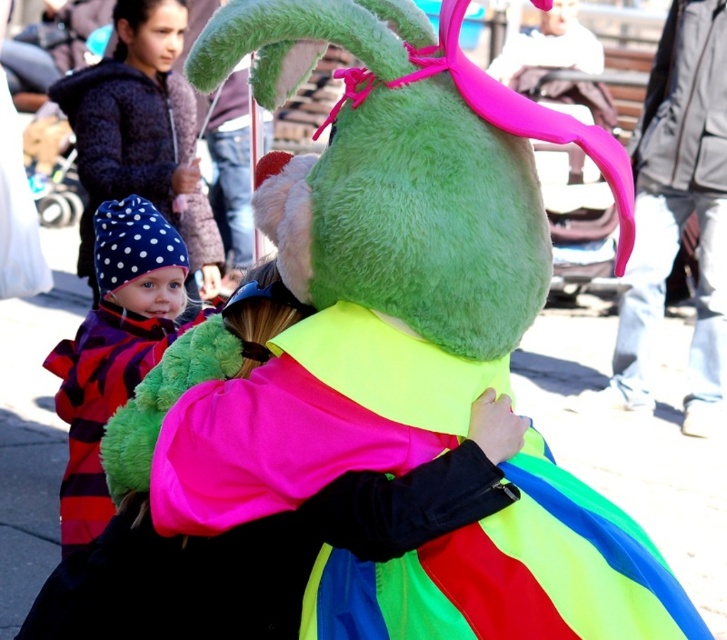
You are a photographer at the event and want to capture a photo where the polka dot fabric hat at lower left is clearly visible above the polka dot fabric hat at left. Which hat should you focus on and why?

The polka dot fabric hat at lower left has a greater height compared to the polka dot fabric hat at left, so focusing on the taller polka dot fabric hat at lower left will ensure it appears above the other in the photo.